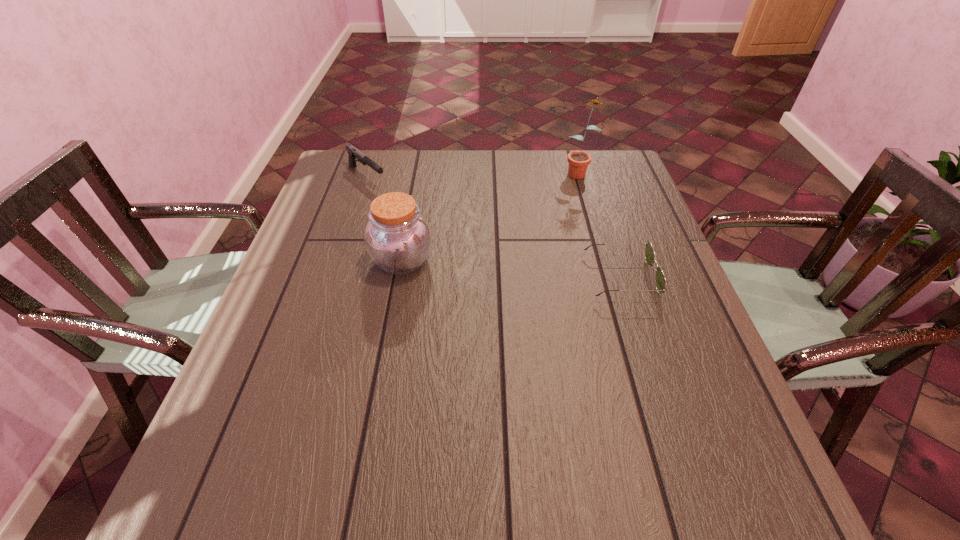
Locate an element on the screen. The height and width of the screenshot is (540, 960). vacant area between the second shortest object and the sunglasses is located at coordinates (493, 226).

Locate an element on the screen. The image size is (960, 540). free spot between the sunflower and the leftmost object is located at coordinates (472, 174).

At what (x,y) coordinates should I click in order to perform the action: click on empty space that is in between the shortest object and the sunflower. Please return your answer as a coordinate pair (x, y). This screenshot has height=540, width=960. Looking at the image, I should click on (599, 224).

This screenshot has height=540, width=960. I want to click on free spot between the tallest object and the shortest object, so click(599, 224).

Select which object appears as the third closest to the second tallest object. Please provide its 2D coordinates. Your answer should be formatted as a tuple, i.e. [(x, y)], where the tuple contains the x and y coordinates of a point satisfying the conditions above.

[(578, 161)]

Locate an element on the screen. This screenshot has width=960, height=540. object that is the third closest to the second object from left to right is located at coordinates (578, 161).

In order to click on free spot that satisfies the following two spatial constraints: 1. on the back side of the tallest object; 2. on the left side of the second shortest object in this screenshot , I will do `click(369, 171)`.

You are a GUI agent. You are given a task and a screenshot of the screen. Output one action in this format:
    pyautogui.click(x=<x>, y=<y>)
    Task: Click on the free space that satisfies the following two spatial constraints: 1. on the front side of the sunflower; 2. on the front-facing side of the shortest object
    The height and width of the screenshot is (540, 960).
    Given the screenshot: What is the action you would take?
    pyautogui.click(x=610, y=276)

You are a GUI agent. You are given a task and a screenshot of the screen. Output one action in this format:
    pyautogui.click(x=<x>, y=<y>)
    Task: Click on the vacant space that satisfies the following two spatial constraints: 1. on the front side of the second object from left to right; 2. on the left side of the gun
    The height and width of the screenshot is (540, 960).
    Given the screenshot: What is the action you would take?
    pyautogui.click(x=339, y=261)

This screenshot has height=540, width=960. I want to click on free space that satisfies the following two spatial constraints: 1. on the back side of the tallest object; 2. on the left side of the third tallest object, so click(369, 171).